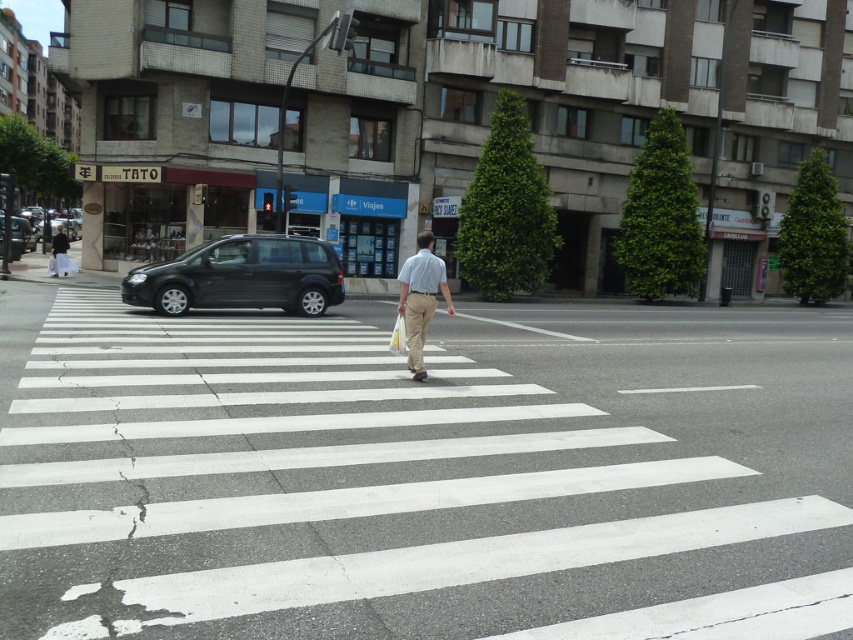
You are a delivery driver who needs to park your vehicle in a space that can only accommodate vehicles narrower than the light beige pants at left. Can the black matte van at center fit in this parking spot?

The black matte van at center has a lesser width compared to the light beige pants at left, so it can fit in the parking spot designed for vehicles narrower than the light beige pants at left.

You are a delivery driver who needs to park your black matte van at center in a specific spot. The parking spot is located at coordinates point 0.433, 0.284. Can you confirm if your van is already parked correctly?

The position of black matte van at center is at point [241,276], so yes, the van is parked correctly at the specified coordinates.

You are a delivery driver who needs to park the black matte van at center behind the light beige pants at left. Based on the scene description, will the van fit vertically behind the pants?

The black matte van at center has a lesser height compared to light beige pants at left, so the van will fit vertically behind the pants since it is shorter in height.